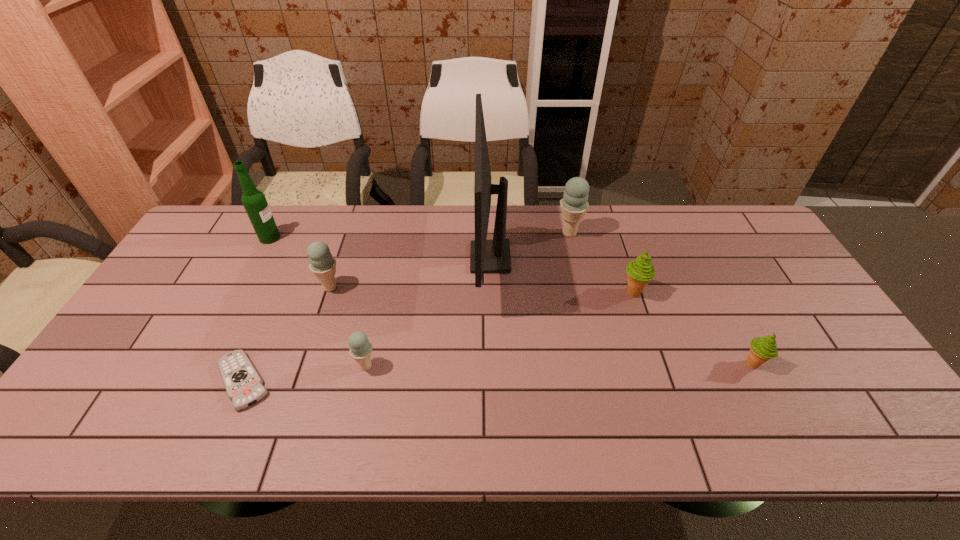
Where is `vacant area that lies between the beer bottle and the fourth object from right to left`? This screenshot has width=960, height=540. vacant area that lies between the beer bottle and the fourth object from right to left is located at coordinates (380, 248).

You are a GUI agent. You are given a task and a screenshot of the screen. Output one action in this format:
    pyautogui.click(x=<x>, y=<y>)
    Task: Click on the empty location between the right green icecream and the leftmost icecream
    The image size is (960, 540).
    Given the screenshot: What is the action you would take?
    pyautogui.click(x=541, y=326)

Locate an element on the screen. The height and width of the screenshot is (540, 960). vacant point located between the fifth object from right to left and the remote control is located at coordinates (304, 374).

Locate an element on the screen. Image resolution: width=960 pixels, height=540 pixels. free space between the remote control and the leftmost object is located at coordinates (256, 309).

Choose which object is the third nearest neighbor to the third object from right to left. Please provide its 2D coordinates. Your answer should be formatted as a tuple, i.e. [(x, y)], where the tuple contains the x and y coordinates of a point satisfying the conditions above.

[(762, 349)]

This screenshot has height=540, width=960. In order to click on object that is the seventh closest to the smaller green icecream in this screenshot , I will do `click(254, 201)`.

Point out which icecream is positioned as the second nearest to the second tallest object. Please provide its 2D coordinates. Your answer should be formatted as a tuple, i.e. [(x, y)], where the tuple contains the x and y coordinates of a point satisfying the conditions above.

[(360, 349)]

Choose which icecream is the third nearest neighbor to the smaller green icecream. Please provide its 2D coordinates. Your answer should be formatted as a tuple, i.e. [(x, y)], where the tuple contains the x and y coordinates of a point satisfying the conditions above.

[(360, 349)]

Point out which blue ice cream is positioned as the second nearest to the beer bottle. Please provide its 2D coordinates. Your answer should be formatted as a tuple, i.e. [(x, y)], where the tuple contains the x and y coordinates of a point satisfying the conditions above.

[(360, 349)]

Select which blue ice cream is the third closest to the computer monitor. Please provide its 2D coordinates. Your answer should be formatted as a tuple, i.e. [(x, y)], where the tuple contains the x and y coordinates of a point satisfying the conditions above.

[(322, 264)]